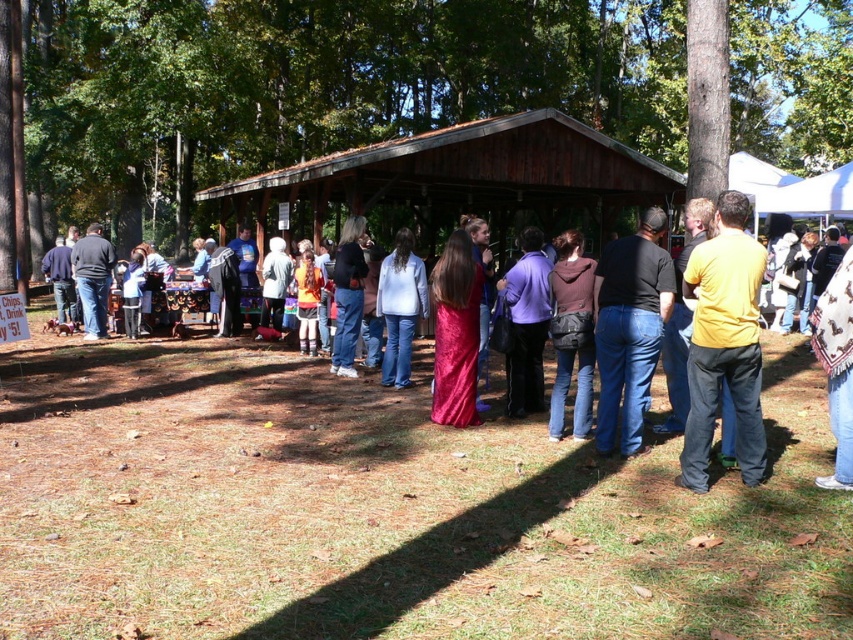
You are at the outdoor gathering and want to borrow a jacket. You see the dark brown leather jacket at center and the matte black shirt at left. Which one is closer to you?

The dark brown leather jacket at center is closer to you because it is positioned under the matte black shirt at left, meaning it is in front of the matte black shirt at left.

You are a photographer standing at the edge of the gathering area. You want to take a photo that includes both the dark brown leather jacket at center and the matte black shirt at left. Given that your camera has a maximum focus range of 10 meters, will you be able to capture both subjects in focus?

The dark brown leather jacket at center is 11.29 meters away from the matte black shirt at left. Since the distance between them exceeds the camera maximum focus range of 10 meters, you will not be able to capture both subjects in focus.